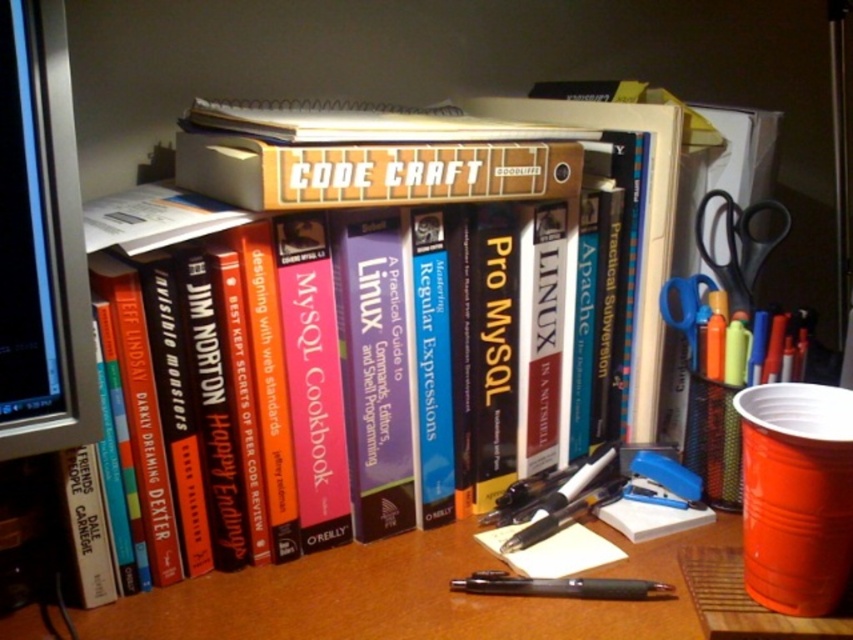
Question: In this image, where is hardcover book at center located relative to blue plastic scissors at right?

Choices:
 (A) right
 (B) left

Answer: (B)

Question: Which point is farther to the camera?

Choices:
 (A) brown wooden table at center
 (B) hardcover book at center

Answer: (A)

Question: Considering the real-world distances, which object is farthest from the hardcover book at center?

Choices:
 (A) black plastic scissors at right
 (B) brown wooden table at center
 (C) matte black monitor at left

Answer: (C)

Question: Is hardcover book at center wider than matte black monitor at left?

Choices:
 (A) yes
 (B) no

Answer: (A)

Question: Which object is positioned farthest from the hardcover book at center?

Choices:
 (A) matte black monitor at left
 (B) blue plastic scissors at right

Answer: (A)

Question: Does brown wooden table at center come in front of matte black monitor at left?

Choices:
 (A) yes
 (B) no

Answer: (B)